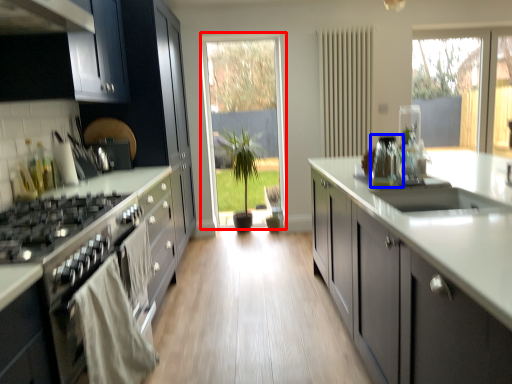
Question: Which of the following is the farthest to the observer, glass door (highlighted by a red box) or appliance (highlighted by a blue box)?

Choices:
 (A) glass door
 (B) appliance

Answer: (A)